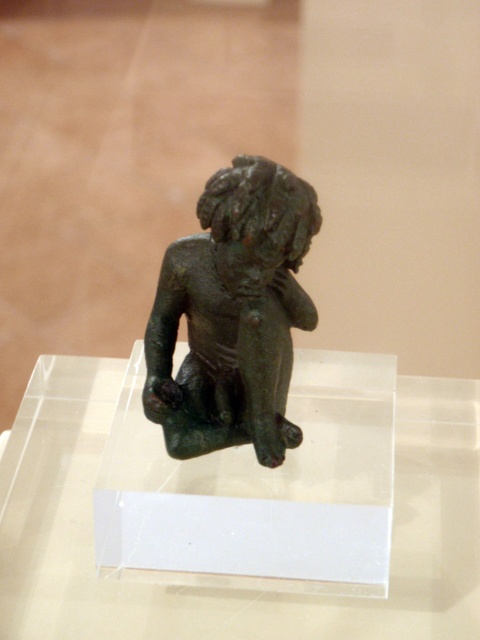
Question: Does transparent acrylic glass table at center appear on the left side of bronze statue at center?

Choices:
 (A) no
 (B) yes

Answer: (A)

Question: Does transparent acrylic glass table at center have a smaller size compared to bronze statue at center?

Choices:
 (A) no
 (B) yes

Answer: (A)

Question: Can you confirm if transparent acrylic glass table at center is positioned above bronze statue at center?

Choices:
 (A) no
 (B) yes

Answer: (A)

Question: Which of the following is the farthest from the observer?

Choices:
 (A) transparent acrylic glass table at center
 (B) bronze statue at center

Answer: (A)

Question: Which of the following is the closest to the observer?

Choices:
 (A) (87, 592)
 (B) (254, 250)

Answer: (B)

Question: Which point appears farthest from the camera in this image?

Choices:
 (A) (12, 632)
 (B) (310, 189)

Answer: (A)